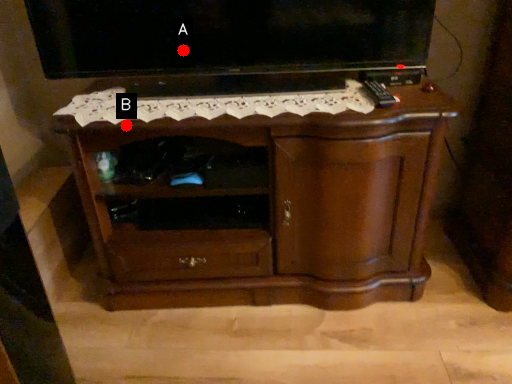
Question: Two points are circled on the image, labeled by A and B beside each circle. Which point is closer to the camera?

Choices:
 (A) A is closer
 (B) B is closer

Answer: (B)